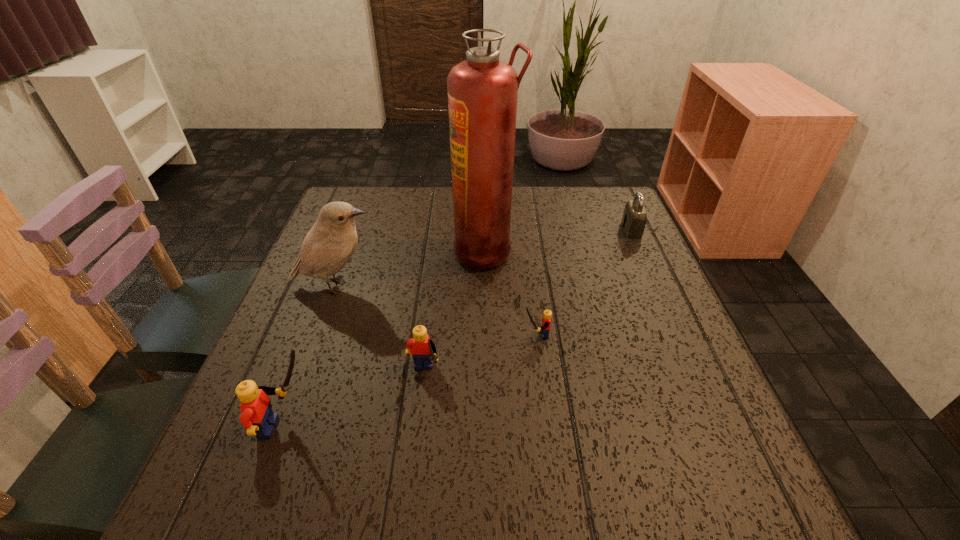
Locate an element on the screen. free space at the near edge of the desktop is located at coordinates [x=398, y=430].

The image size is (960, 540). What are the coordinates of `vacant space at the left edge of the desktop` in the screenshot? It's located at (371, 236).

Locate an element on the screen. The width and height of the screenshot is (960, 540). vacant space at the right edge is located at coordinates (652, 263).

Find the location of a particular element. vacant area that lies between the second Lego from right to left and the shortest object is located at coordinates (479, 355).

You are a GUI agent. You are given a task and a screenshot of the screen. Output one action in this format:
    pyautogui.click(x=<x>, y=<y>)
    Task: Click on the free space between the second Lego from right to left and the shortest object
    The width and height of the screenshot is (960, 540).
    Given the screenshot: What is the action you would take?
    pyautogui.click(x=479, y=355)

Identify the location of free space between the padlock and the nearest Lego. This screenshot has height=540, width=960. (459, 328).

Find the location of `vacant region between the tallest object and the padlock`. vacant region between the tallest object and the padlock is located at coordinates (559, 240).

This screenshot has width=960, height=540. I want to click on free area in between the shortest Lego and the third farthest object, so click(436, 310).

This screenshot has width=960, height=540. Find the location of `free spot between the bird and the leftmost Lego`. free spot between the bird and the leftmost Lego is located at coordinates (312, 356).

Locate an element on the screen. free space between the nearest object and the padlock is located at coordinates (459, 328).